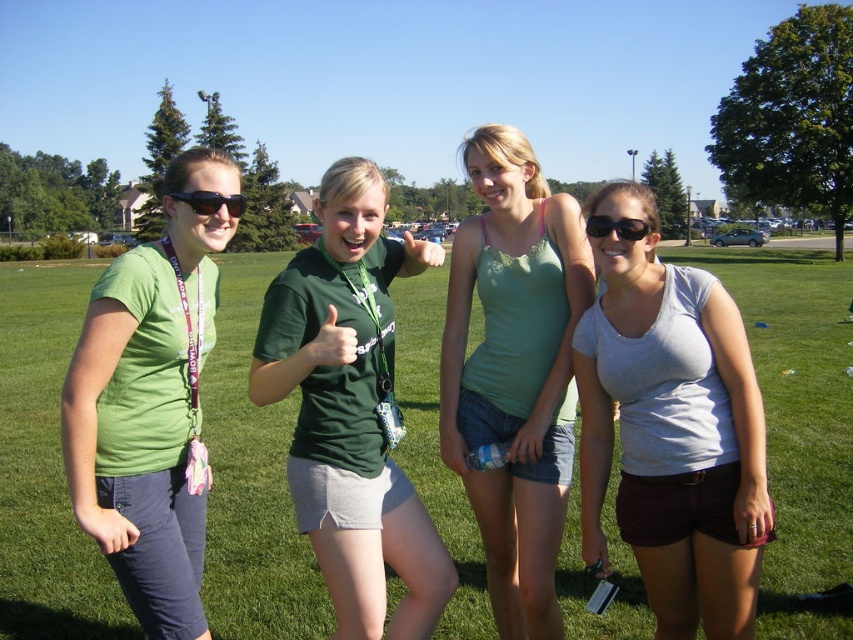
Is green lace tank top at center closer to the viewer compared to black plastic sunglasses at upper center?

No.

Who is lower down, green lace tank top at center or black plastic sunglasses at upper center?

black plastic sunglasses at upper center

Who is more forward, (558, 259) or (630, 240)?

Point (630, 240)

The image size is (853, 640). I want to click on green lace tank top at center, so click(514, 371).

Based on the photo, which is more to the right, green fabric shirt at left or matte black sunglasses at upper left?

matte black sunglasses at upper left is more to the right.

Can you confirm if green fabric shirt at left is positioned below matte black sunglasses at upper left?

Indeed, green fabric shirt at left is positioned under matte black sunglasses at upper left.

Is point (80, 410) behind point (175, 192)?

That is False.

You are a GUI agent. You are given a task and a screenshot of the screen. Output one action in this format:
    pyautogui.click(x=<x>, y=<y>)
    Task: Click on the green fabric shirt at left
    The height and width of the screenshot is (640, 853).
    Given the screenshot: What is the action you would take?
    pyautogui.click(x=137, y=442)

Can you confirm if green grass at center is thinner than black plastic sunglasses at upper center?

In fact, green grass at center might be wider than black plastic sunglasses at upper center.

Which is behind, point (840, 320) or point (601, 216)?

The point (840, 320) is behind.

Describe the element at coordinates (798, 420) in the screenshot. I see `green grass at center` at that location.

The image size is (853, 640). I want to click on green grass at center, so click(x=798, y=420).